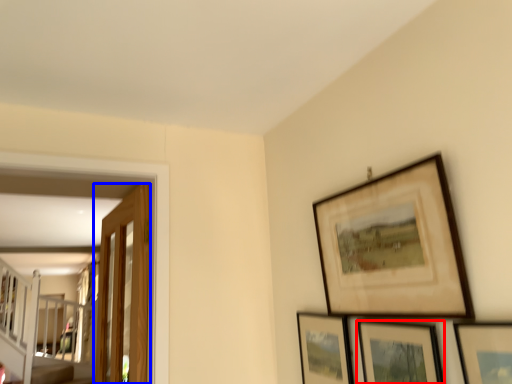
Question: Among these objects, which one is nearest to the camera, picture frame (highlighted by a red box) or door (highlighted by a blue box)?

Choices:
 (A) picture frame
 (B) door

Answer: (A)